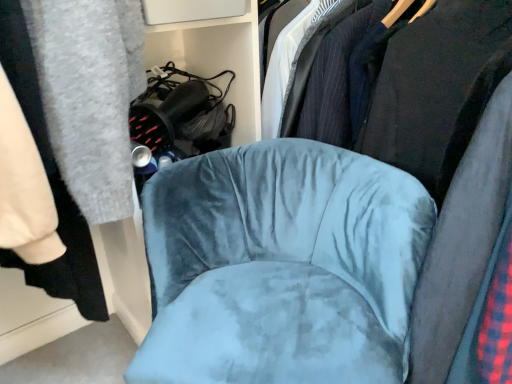
In order to face velvet blue chair at center, should I rotate leftwards or rightwards?

Turn right approximately 11.746 degrees to face it.

You are a GUI agent. You are given a task and a screenshot of the screen. Output one action in this format:
    pyautogui.click(x=<x>, y=<y>)
    Task: Click on the velvet blue chair at center
    The width and height of the screenshot is (512, 384).
    Given the screenshot: What is the action you would take?
    pyautogui.click(x=436, y=87)

Is velvet blue chair at center taller or shorter than velvet blue chair at center?

velvet blue chair at center is shorter than velvet blue chair at center.

Which is behind, velvet blue chair at center or velvet blue chair at center?

velvet blue chair at center is further away from the camera.

From the image's perspective, which object appears higher, velvet blue chair at center or velvet blue chair at center?

velvet blue chair at center is shown above in the image.

From a real-world perspective, who is located higher, velvet blue chair at center or velvet blue chair at center?

velvet blue chair at center is physically above.

Is velvet blue chair at center inside or outside of velvet blue chair at center?

velvet blue chair at center is outside velvet blue chair at center.

Can you confirm if velvet blue chair at center is thinner than velvet blue chair at center?

Indeed, velvet blue chair at center has a lesser width compared to velvet blue chair at center.

In the scene shown: How many degrees apart are the facing directions of velvet blue chair at center and velvet blue chair at center?

The facing directions of velvet blue chair at center and velvet blue chair at center are 43.8 degrees apart.

In terms of size, does velvet blue chair at center appear bigger or smaller than velvet blue chair at center?

velvet blue chair at center is smaller than velvet blue chair at center.

Is velvet black bookshelf at upper center to the left of velvet blue chair at center from the viewer's perspective?

Correct, you'll find velvet black bookshelf at upper center to the left of velvet blue chair at center.

Is the depth of velvet black bookshelf at upper center greater than that of velvet blue chair at center?

Yes, velvet black bookshelf at upper center is further from the camera.

Considering the sizes of objects velvet black bookshelf at upper center and velvet blue chair at center in the image provided, who is thinner, velvet black bookshelf at upper center or velvet blue chair at center?

velvet black bookshelf at upper center.

Where is `clothing above the velvet black bookshelf at upper center (from a real-world perspective)`? The height and width of the screenshot is (384, 512). clothing above the velvet black bookshelf at upper center (from a real-world perspective) is located at coordinates (436, 87).

Is velvet black bookshelf at upper center looking in the opposite direction of velvet blue chair at center?

No, velvet blue chair at center is not at the back of velvet black bookshelf at upper center.

Would you say velvet blue chair at center is part of velvet black bookshelf at upper center's contents?

No, velvet blue chair at center is not surrounded by velvet black bookshelf at upper center.

How much distance is there between velvet black bookshelf at upper center and velvet blue chair at center?

velvet black bookshelf at upper center is 15.87 inches away from velvet blue chair at center.

Considering their positions, is velvet black bookshelf at upper center located in front of or behind velvet blue chair at center?

In the image, velvet black bookshelf at upper center appears behind velvet blue chair at center.

From the picture: Between velvet blue chair at center and velvet black bookshelf at upper center, which one has less height?

velvet black bookshelf at upper center.

From the image's perspective, which is below, velvet blue chair at center or velvet black bookshelf at upper center?

velvet black bookshelf at upper center.

Which object is wider, velvet blue chair at center or velvet black bookshelf at upper center?

velvet blue chair at center is wider.

Does velvet blue chair at center touch velvet black bookshelf at upper center?

velvet blue chair at center and velvet black bookshelf at upper center are not in contact.

From a real-world perspective, between velvet blue chair at center and velvet black bookshelf at upper center, who is vertically higher?

velvet black bookshelf at upper center, from a real-world perspective.

From the image's perspective, which one is positioned higher, velvet blue chair at center or velvet black bookshelf at upper center?

velvet black bookshelf at upper center, from the image's perspective.

Consider the image. Does velvet blue chair at center have a greater width compared to velvet black bookshelf at upper center?

Yes, velvet blue chair at center is wider than velvet black bookshelf at upper center.

Image resolution: width=512 pixels, height=384 pixels. I want to click on chair in front of the velvet blue chair at center, so click(282, 266).

This screenshot has width=512, height=384. Find the location of `clothing above the velvet blue chair at center (from a real-world perspective)`. clothing above the velvet blue chair at center (from a real-world perspective) is located at coordinates (436, 87).

Which object lies nearer to the anchor point velvet blue chair at center, velvet black bookshelf at upper center or velvet blue chair at center?

velvet blue chair at center is positioned closer to the anchor velvet blue chair at center.

Looking at this image, estimate the real-world distances between objects in this image. Which object is further from velvet blue chair at center, velvet blue chair at center or velvet black bookshelf at upper center?

Based on the image, velvet black bookshelf at upper center appears to be further to velvet blue chair at center.

Looking at the image, which one is located closer to velvet blue chair at center, velvet black bookshelf at upper center or velvet blue chair at center?

velvet blue chair at center lies closer to velvet blue chair at center than the other object.

Looking at this image, from the image, which object appears to be nearer to velvet blue chair at center, velvet blue chair at center or velvet black bookshelf at upper center?

Among the two, velvet blue chair at center is located nearer to velvet blue chair at center.

From the image, which object appears to be farther from velvet black bookshelf at upper center, velvet blue chair at center or velvet blue chair at center?

Among the two, velvet blue chair at center is located further to velvet black bookshelf at upper center.

Estimate the real-world distances between objects in this image. Which object is further from velvet black bookshelf at upper center, velvet blue chair at center or velvet blue chair at center?

velvet blue chair at center.

At what (x,y) coordinates should I click in order to perform the action: click on bookshelf between velvet blue chair at center and velvet blue chair at center in the vertical direction. Please return your answer as a coordinate pair (x, y). The width and height of the screenshot is (512, 384). Looking at the image, I should click on (220, 61).